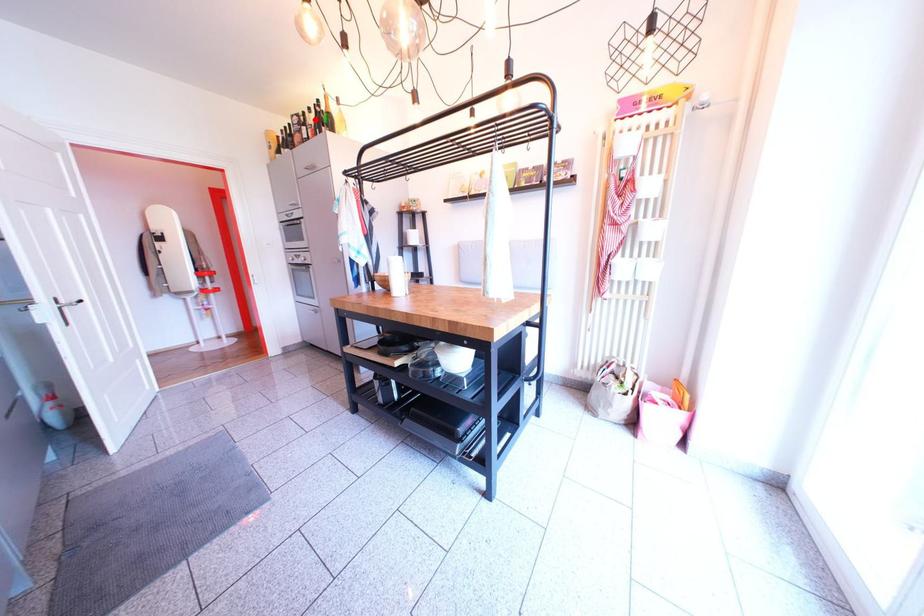
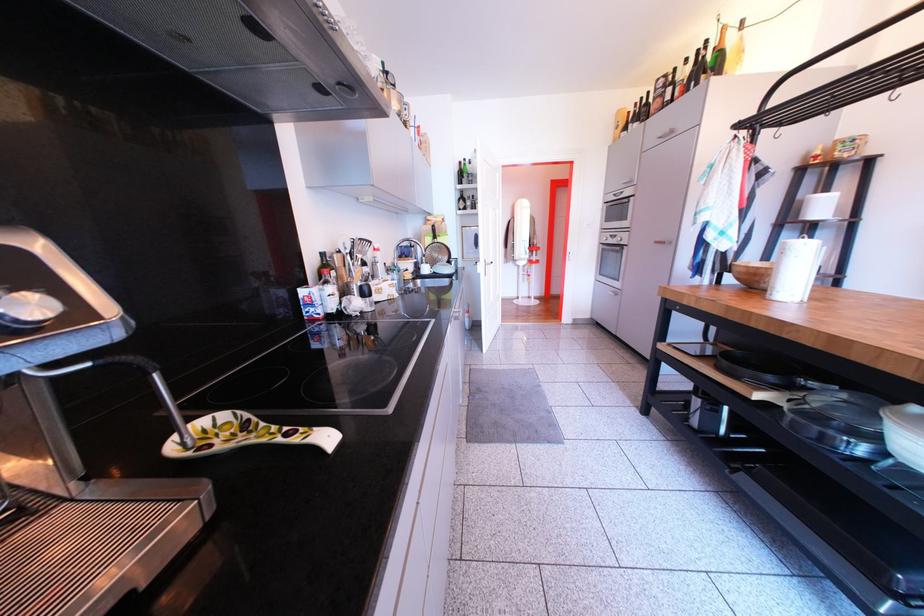
Question: A red point is marked in image1. In image2, is the corresponding 3D point closer to the camera or farther? Reply with the corresponding letter.

Choices:
 (A) The corresponding 3D point is closer.
 (B) The corresponding 3D point is farther.

Answer: (B)